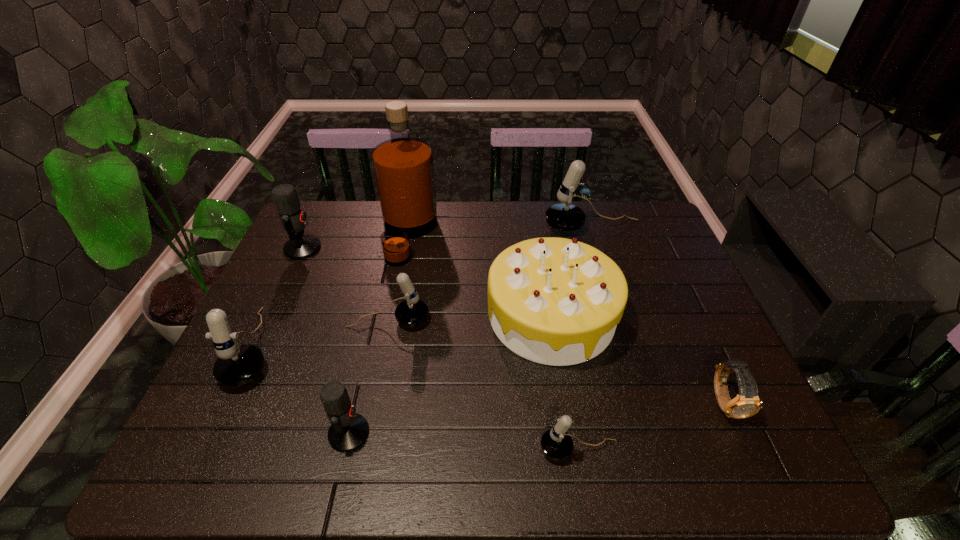
You are a GUI agent. You are given a task and a screenshot of the screen. Output one action in this format:
    pyautogui.click(x=<x>, y=<y>)
    Task: Click on the vacant space that satisfies the following two spatial constraints: 1. on the side of the birthday cake with the red ring; 2. on the right side of the left red microphone
    
    Given the screenshot: What is the action you would take?
    pyautogui.click(x=272, y=316)

This screenshot has height=540, width=960. I want to click on free space that satisfies the following two spatial constraints: 1. on the front side of the biggest white microphone; 2. on the side of the bigger red microphone with the red ring, so click(x=599, y=248).